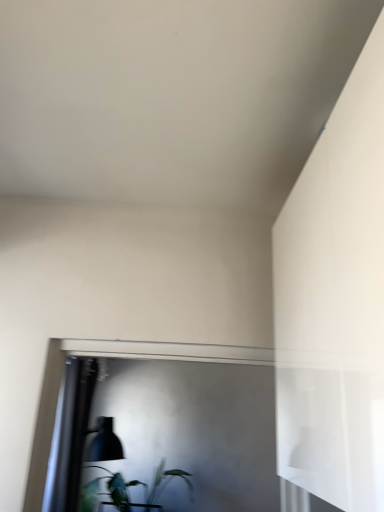
Question: Considering the relative sizes of matte black lampshade at lower left and green leafy plant at lower left in the image provided, is matte black lampshade at lower left taller than green leafy plant at lower left?

Choices:
 (A) yes
 (B) no

Answer: (A)

Question: Is matte black lampshade at lower left positioned beyond the bounds of green leafy plant at lower left?

Choices:
 (A) no
 (B) yes

Answer: (B)

Question: From the image's perspective, would you say matte black lampshade at lower left is shown under green leafy plant at lower left?

Choices:
 (A) no
 (B) yes

Answer: (A)

Question: Would you say matte black lampshade at lower left is a long distance from green leafy plant at lower left?

Choices:
 (A) no
 (B) yes

Answer: (A)

Question: Is matte black lampshade at lower left thinner than green leafy plant at lower left?

Choices:
 (A) no
 (B) yes

Answer: (B)

Question: Does matte black lampshade at lower left have a greater width compared to green leafy plant at lower left?

Choices:
 (A) no
 (B) yes

Answer: (A)

Question: Does green leafy plant at lower left have a greater height compared to matte black lampshade at lower left?

Choices:
 (A) yes
 (B) no

Answer: (B)

Question: Is green leafy plant at lower left looking in the opposite direction of matte black lampshade at lower left?

Choices:
 (A) yes
 (B) no

Answer: (B)

Question: Does green leafy plant at lower left turn towards matte black lampshade at lower left?

Choices:
 (A) no
 (B) yes

Answer: (B)

Question: Is green leafy plant at lower left in front of matte black lampshade at lower left?

Choices:
 (A) no
 (B) yes

Answer: (A)

Question: Does green leafy plant at lower left appear on the right side of matte black lampshade at lower left?

Choices:
 (A) no
 (B) yes

Answer: (B)

Question: From a real-world perspective, is green leafy plant at lower left physically below matte black lampshade at lower left?

Choices:
 (A) no
 (B) yes

Answer: (B)

Question: From the image's perspective, is matte black lampshade at lower left located above or below green leafy plant at lower left?

Choices:
 (A) above
 (B) below

Answer: (A)